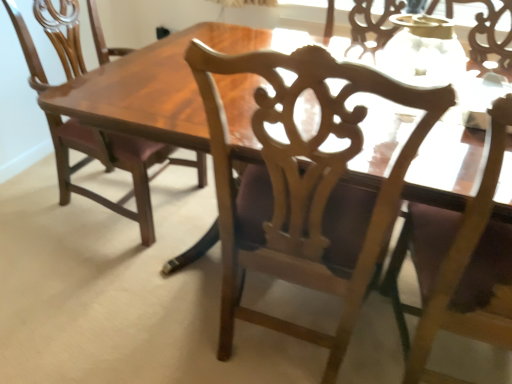
Identify the location of wooden carved chair at center, which ranks as the 2th chair in right-to-left order. (305, 187).

What is the approximate width of wooden carved chair at center, which ranks as the 2th chair in left-to-right order?

16.93 inches.

The image size is (512, 384). What do you see at coordinates (458, 266) in the screenshot?
I see `light wood chair at upper right, marked as the third chair in a left-to-right arrangement` at bounding box center [458, 266].

The width and height of the screenshot is (512, 384). I want to click on light wood chair at upper right, marked as the third chair in a left-to-right arrangement, so click(x=458, y=266).

What is the approximate width of matte wood chair at left, which appears as the first chair when viewed from the left?

24.20 inches.

At what (x,y) coordinates should I click in order to perform the action: click on wooden carved chair at center, which ranks as the 2th chair in right-to-left order. Please return your answer as a coordinate pair (x, y). Looking at the image, I should click on (305, 187).

Considering the positions of point (70, 30) and point (370, 269), is point (70, 30) closer or farther from the camera than point (370, 269)?

Point (70, 30) is farther from the camera than point (370, 269).

Is matte wood chair at left, acting as the third chair starting from the right, turned away from wooden carved chair at center, which ranks as the 2th chair in right-to-left order?

No, matte wood chair at left, acting as the third chair starting from the right, is not facing away from wooden carved chair at center, which ranks as the 2th chair in right-to-left order.

Which of these two, matte wood chair at left, acting as the third chair starting from the right, or wooden carved chair at center, which ranks as the 2th chair in left-to-right order, is bigger?

matte wood chair at left, acting as the third chair starting from the right.

Does matte wood chair at left, which appears as the first chair when viewed from the left, have a lesser height compared to wooden carved chair at center, which ranks as the 2th chair in left-to-right order?

Yes.

Considering the sizes of objects matte wood chair at left, which appears as the first chair when viewed from the left, and light wood chair at upper right, which ranks as the first chair in right-to-left order, in the image provided, who is thinner, matte wood chair at left, which appears as the first chair when viewed from the left, or light wood chair at upper right, which ranks as the first chair in right-to-left order,?

light wood chair at upper right, which ranks as the first chair in right-to-left order, is thinner.

Can you confirm if matte wood chair at left, acting as the third chair starting from the right, is bigger than light wood chair at upper right, which ranks as the first chair in right-to-left order?

Indeed, matte wood chair at left, acting as the third chair starting from the right, has a larger size compared to light wood chair at upper right, which ranks as the first chair in right-to-left order.

From a real-world perspective, starting from the matte wood chair at left, which appears as the first chair when viewed from the left, which chair is the 1st one vertically above it? Please provide its 2D coordinates.

[(458, 266)]

From the image's perspective, is wooden carved chair at center, which ranks as the 2th chair in right-to-left order, above or below matte wood chair at left, acting as the third chair starting from the right?

Clearly, from the image's perspective, wooden carved chair at center, which ranks as the 2th chair in right-to-left order, is below matte wood chair at left, acting as the third chair starting from the right.

Is matte wood chair at left, which appears as the first chair when viewed from the left, at the back of wooden carved chair at center, which ranks as the 2th chair in right-to-left order?

That's not correct — wooden carved chair at center, which ranks as the 2th chair in right-to-left order, is not looking away from matte wood chair at left, which appears as the first chair when viewed from the left.

Are wooden carved chair at center, which ranks as the 2th chair in right-to-left order, and matte wood chair at left, acting as the third chair starting from the right, located far from each other?

They are positioned close to each other.

Does wooden carved chair at center, which ranks as the 2th chair in right-to-left order, appear on the right side of light wood chair at upper right, which ranks as the first chair in right-to-left order?

No, wooden carved chair at center, which ranks as the 2th chair in right-to-left order, is not to the right of light wood chair at upper right, which ranks as the first chair in right-to-left order.

Does point (250, 221) lie behind point (495, 309)?

That is True.

Can you confirm if wooden carved chair at center, which ranks as the 2th chair in left-to-right order, is shorter than light wood chair at upper right, marked as the third chair in a left-to-right arrangement?

No.

Locate an element on the screen. The image size is (512, 384). the 1st chair behind the light wood chair at upper right, which ranks as the first chair in right-to-left order is located at coordinates (305, 187).

Is light wood chair at upper right, marked as the third chair in a left-to-right arrangement, taller or shorter than matte wood chair at left, acting as the third chair starting from the right?

Considering their sizes, light wood chair at upper right, marked as the third chair in a left-to-right arrangement, has more height than matte wood chair at left, acting as the third chair starting from the right.

Are light wood chair at upper right, marked as the third chair in a left-to-right arrangement, and matte wood chair at left, acting as the third chair starting from the right, located far from each other?

Yes, light wood chair at upper right, marked as the third chair in a left-to-right arrangement, and matte wood chair at left, acting as the third chair starting from the right, are quite far apart.

Does light wood chair at upper right, marked as the third chair in a left-to-right arrangement, have a lesser width compared to matte wood chair at left, acting as the third chair starting from the right?

Yes.

Visually, is light wood chair at upper right, which ranks as the first chair in right-to-left order, positioned to the left or to the right of wooden carved chair at center, which ranks as the 2th chair in right-to-left order?

Based on their positions, light wood chair at upper right, which ranks as the first chair in right-to-left order, is located to the right of wooden carved chair at center, which ranks as the 2th chair in right-to-left order.

Is light wood chair at upper right, which ranks as the first chair in right-to-left order, not close to wooden carved chair at center, which ranks as the 2th chair in right-to-left order?

No, light wood chair at upper right, which ranks as the first chair in right-to-left order, is in close proximity to wooden carved chair at center, which ranks as the 2th chair in right-to-left order.

Can you confirm if light wood chair at upper right, marked as the third chair in a left-to-right arrangement, is taller than wooden carved chair at center, which ranks as the 2th chair in left-to-right order?

No.

From a real-world perspective, is light wood chair at upper right, marked as the third chair in a left-to-right arrangement, above or below wooden carved chair at center, which ranks as the 2th chair in right-to-left order?

In terms of real-world spatial position, light wood chair at upper right, marked as the third chair in a left-to-right arrangement, is below wooden carved chair at center, which ranks as the 2th chair in right-to-left order.

At what (x,y) coordinates should I click in order to perform the action: click on the 1st chair to the right of the matte wood chair at left, acting as the third chair starting from the right, starting your count from the anchor. Please return your answer as a coordinate pair (x, y). Looking at the image, I should click on (305, 187).

Where is `the 2nd chair in front of the matte wood chair at left, acting as the third chair starting from the right`? Image resolution: width=512 pixels, height=384 pixels. the 2nd chair in front of the matte wood chair at left, acting as the third chair starting from the right is located at coordinates (458, 266).

Considering their positions, is wooden carved chair at center, which ranks as the 2th chair in right-to-left order, positioned closer to matte wood chair at left, which appears as the first chair when viewed from the left, than light wood chair at upper right, which ranks as the first chair in right-to-left order?

The object closer to matte wood chair at left, which appears as the first chair when viewed from the left, is wooden carved chair at center, which ranks as the 2th chair in right-to-left order.

Looking at the image, which one is located further to matte wood chair at left, which appears as the first chair when viewed from the left, light wood chair at upper right, which ranks as the first chair in right-to-left order, or wooden carved chair at center, which ranks as the 2th chair in left-to-right order?

light wood chair at upper right, which ranks as the first chair in right-to-left order.

Based on their spatial positions, is wooden carved chair at center, which ranks as the 2th chair in right-to-left order, or matte wood chair at left, which appears as the first chair when viewed from the left, closer to light wood chair at upper right, which ranks as the first chair in right-to-left order?

Among the two, wooden carved chair at center, which ranks as the 2th chair in right-to-left order, is located nearer to light wood chair at upper right, which ranks as the first chair in right-to-left order.

Considering their positions, is matte wood chair at left, acting as the third chair starting from the right, positioned further to light wood chair at upper right, which ranks as the first chair in right-to-left order, than wooden carved chair at center, which ranks as the 2th chair in right-to-left order?

matte wood chair at left, acting as the third chair starting from the right, is positioned further to the anchor light wood chair at upper right, which ranks as the first chair in right-to-left order.

Considering their positions, is light wood chair at upper right, marked as the third chair in a left-to-right arrangement, positioned further to wooden carved chair at center, which ranks as the 2th chair in left-to-right order, than matte wood chair at left, acting as the third chair starting from the right?

Based on the image, matte wood chair at left, acting as the third chair starting from the right, appears to be further to wooden carved chair at center, which ranks as the 2th chair in left-to-right order.

Estimate the real-world distances between objects in this image. Which object is further from wooden carved chair at center, which ranks as the 2th chair in right-to-left order, matte wood chair at left, which appears as the first chair when viewed from the left, or light wood chair at upper right, marked as the third chair in a left-to-right arrangement?

The object further to wooden carved chair at center, which ranks as the 2th chair in right-to-left order, is matte wood chair at left, which appears as the first chair when viewed from the left.

This screenshot has height=384, width=512. I want to click on chair between matte wood chair at left, which appears as the first chair when viewed from the left, and light wood chair at upper right, which ranks as the first chair in right-to-left order, so click(305, 187).